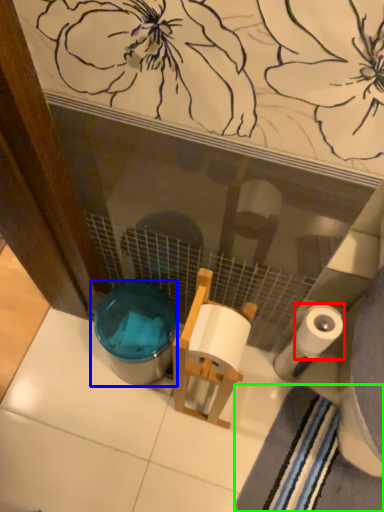
Question: Considering the real-world distances, which object is closest to toilet paper (highlighted by a red box)? potty (highlighted by a blue box) or bath towel (highlighted by a green box).

Choices:
 (A) potty
 (B) bath towel

Answer: (B)